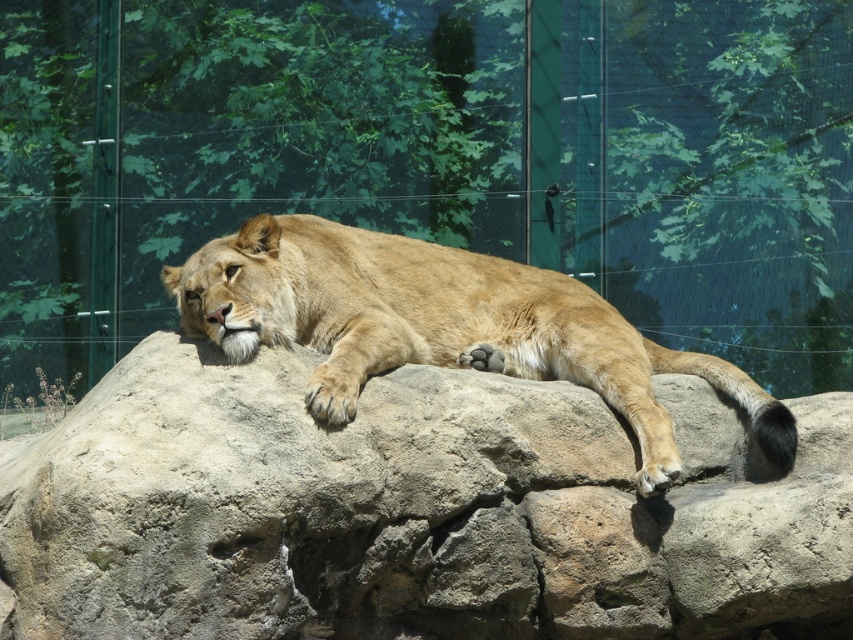
In the scene shown: Who is positioned more to the left, smooth rock at center or golden fur lion at center?

From the viewer's perspective, golden fur lion at center appears more on the left side.

Between smooth rock at center and golden fur lion at center, which one appears on the right side from the viewer's perspective?

smooth rock at center is more to the right.

Is point (381, 520) positioned before point (527, 291)?

Yes, point (381, 520) is closer to viewer.

This screenshot has height=640, width=853. I want to click on smooth rock at center, so click(x=410, y=509).